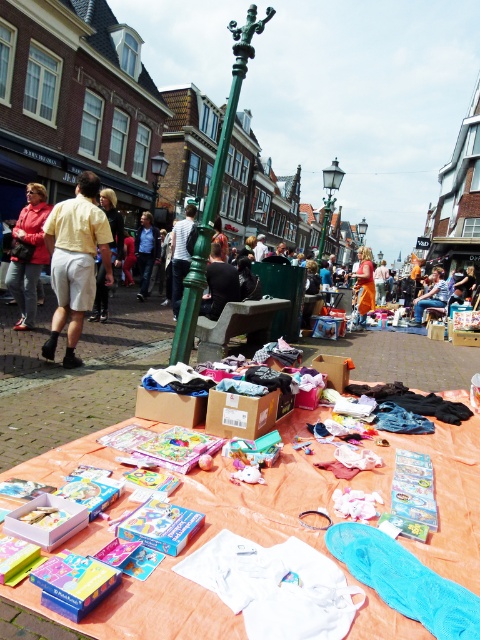
Looking at this image, you are a customer at the market and want to buy both the black fabric jacket at center and the orange cotton shirt at center. If you have a bag that can only hold one of them due to size constraints, which item should you choose based on their sizes?

The black fabric jacket at center has a smaller size compared to the orange cotton shirt at center, so you should choose the black fabric jacket at center to fit in your bag.